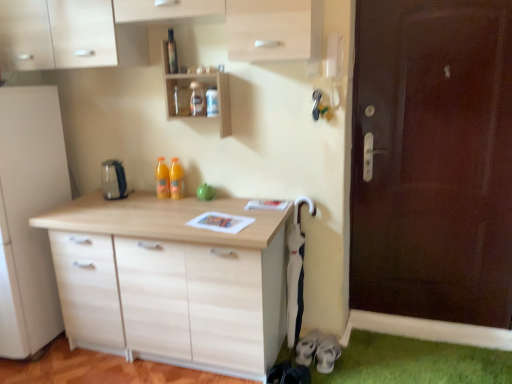
Question: Is satin silver kettle at center bigger or smaller than orange translucent bottle at center, the 2th bottle when ordered from front to back?

Choices:
 (A) small
 (B) big

Answer: (B)

Question: Is satin silver kettle at center taller or shorter than orange translucent bottle at center, the first bottle viewed from the left?

Choices:
 (A) short
 (B) tall

Answer: (A)

Question: Estimate the real-world distances between objects in this image. Which object is closer to the transparent glass bottle at upper center, acting as the 2th bottle starting from the bottom?

Choices:
 (A) wooden shelf at upper center
 (B) orange translucent bottle at center, arranged as the 1th bottle when viewed from the back
 (C) satin silver kettle at center

Answer: (A)

Question: Estimate the real-world distances between objects in this image. Which object is farther from the wooden shelf at upper center?

Choices:
 (A) transparent glass bottle at upper center, arranged as the first bottle when viewed from the right
 (B) orange translucent bottle at center, which is the second bottle in top-to-bottom order
 (C) satin silver kettle at center

Answer: (C)